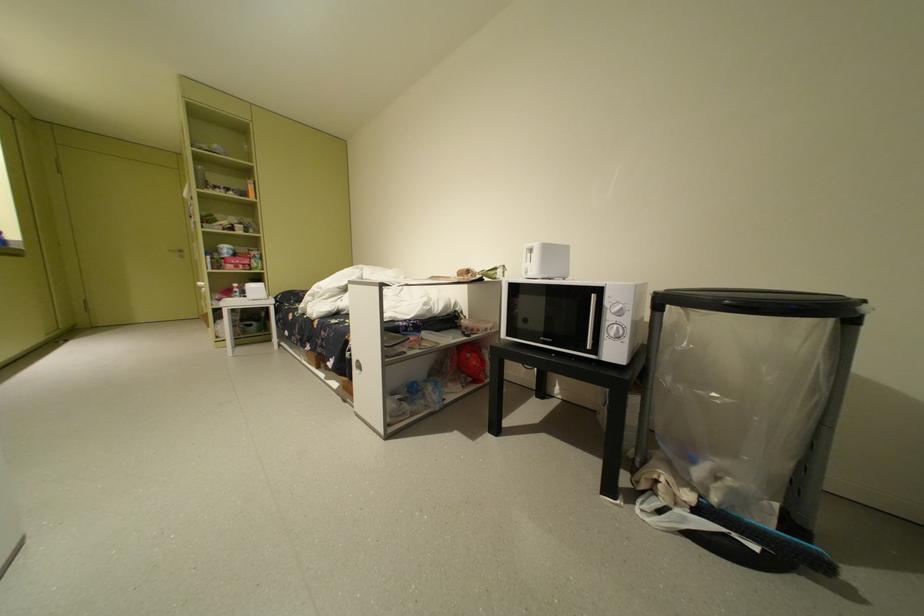
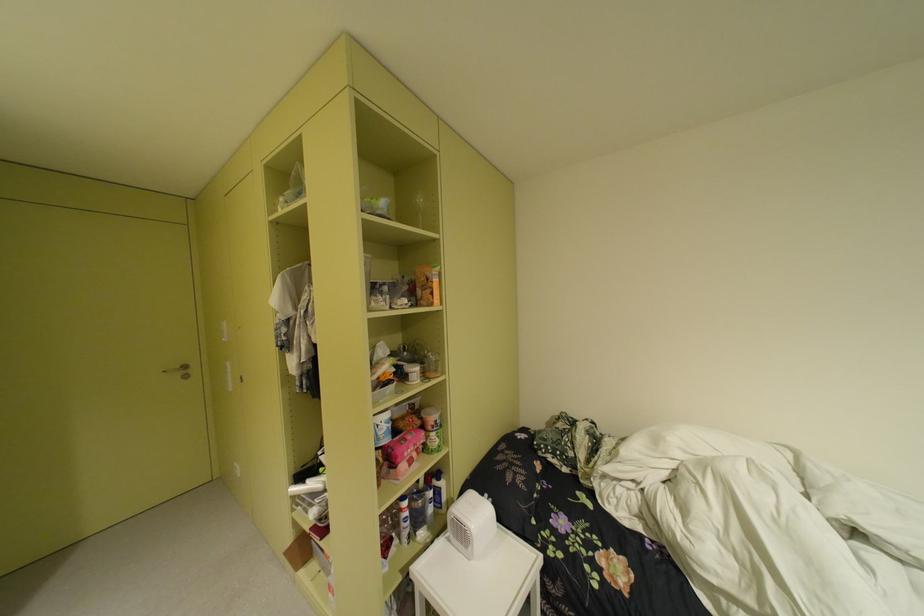
The point at (257, 232) is marked in the first image. Where is the corresponding point in the second image?

(434, 376)